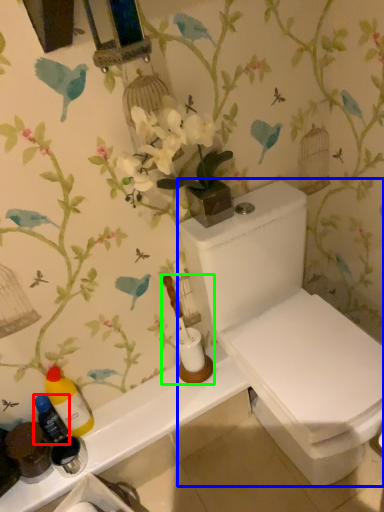
Question: Estimate the real-world distances between objects in this image. Which object is farther from bottle (highlighted by a red box), toilet (highlighted by a blue box) or toiletries (highlighted by a green box)?

Choices:
 (A) toilet
 (B) toiletries

Answer: (A)